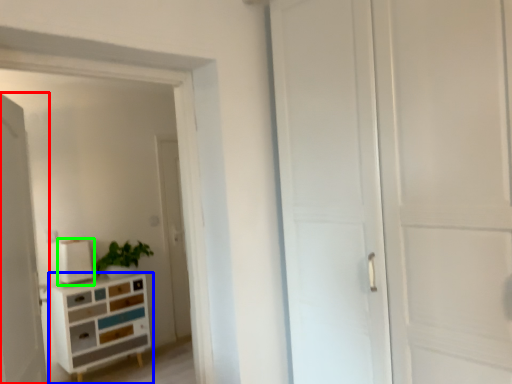
Question: Which object is the closest to the door (highlighted by a red box)? Choose among these: chest of drawers (highlighted by a blue box) or appliance (highlighted by a green box).

Choices:
 (A) chest of drawers
 (B) appliance

Answer: (A)